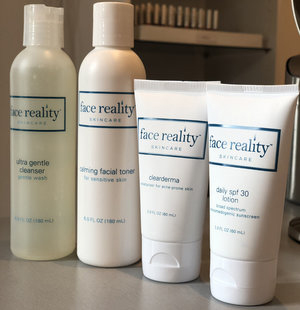
Image resolution: width=300 pixels, height=310 pixels. I want to click on shelf, so click(x=205, y=36).